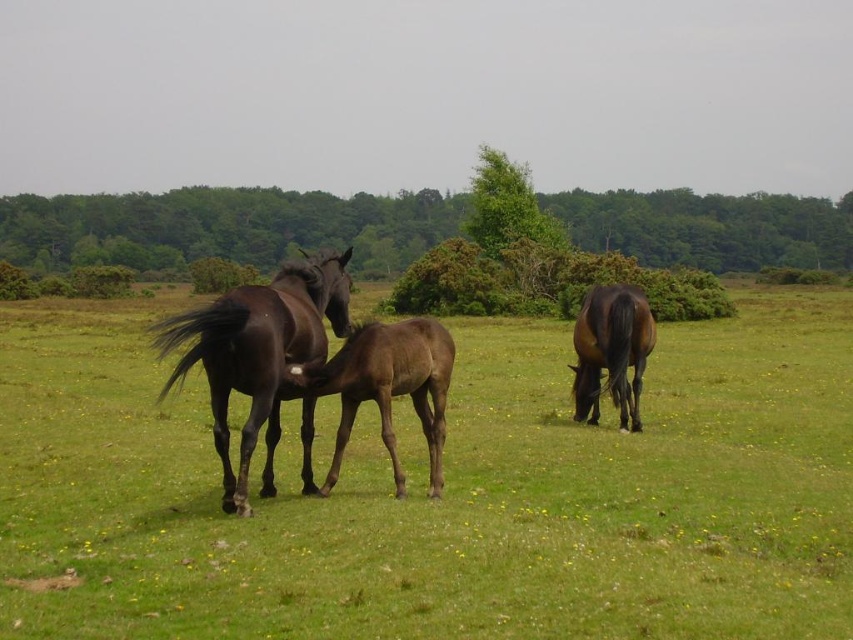
You are a photographer positioned in the field where the dark brown glossy horse at center and the shiny brown horse at right are located. You want to capture a photo where both horses are visible in the frame. Based on their positions, which horse should you position closer to the left side of your camera frame?

The dark brown glossy horse at center is to the left of the shiny brown horse at right, so you should position the dark brown glossy horse at center closer to the left side of your camera frame to include both in the shot.

From the picture: You are a photographer trying to capture the dark brown glossy horse at center and the shiny brown horse at right in a single shot. Based on their positions, which horse will appear closer to the camera in the photo?

The dark brown glossy horse at center will appear closer to the camera in the photo because it is positioned in front of the shiny brown horse at right.